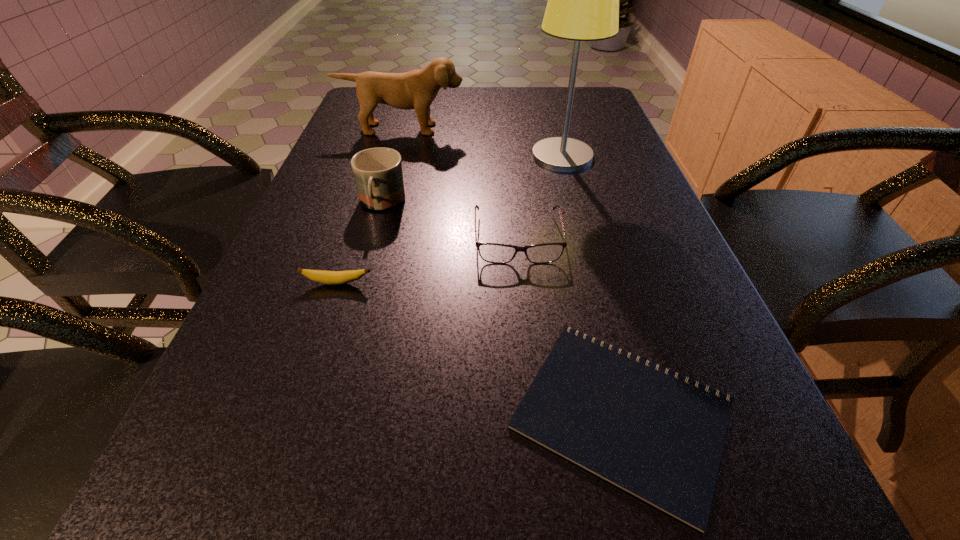
Locate an element on the screen. The width and height of the screenshot is (960, 540). free spot between the shortest object and the table lamp is located at coordinates (592, 285).

At what (x,y) coordinates should I click in order to perform the action: click on vacant space that is in between the notepad and the second farthest object. Please return your answer as a coordinate pair (x, y). Looking at the image, I should click on (592, 285).

The image size is (960, 540). Identify the location of vacant space in between the notepad and the third shortest object. (569, 326).

You are a GUI agent. You are given a task and a screenshot of the screen. Output one action in this format:
    pyautogui.click(x=<x>, y=<y>)
    Task: Click on the free space between the farthest object and the tallest object
    
    Given the screenshot: What is the action you would take?
    pyautogui.click(x=482, y=143)

In order to click on the fourth closest object relative to the spectacles in this screenshot , I will do pos(327,277).

The image size is (960, 540). Identify the location of the fourth closest object to the mug. (583, 0).

Identify the location of free space that satisfies the following two spatial constraints: 1. on the left side of the table lamp; 2. on the right side of the fifth shortest object. (395, 156).

This screenshot has height=540, width=960. Identify the location of vacant position in the image that satisfies the following two spatial constraints: 1. on the lenses of the nearest object; 2. on the right side of the spectacles. (535, 414).

Where is `blank space that satisfies the following two spatial constraints: 1. on the side with the handle of the fourth shortest object; 2. on the right side of the shortest object`? Image resolution: width=960 pixels, height=540 pixels. blank space that satisfies the following two spatial constraints: 1. on the side with the handle of the fourth shortest object; 2. on the right side of the shortest object is located at coordinates (324, 414).